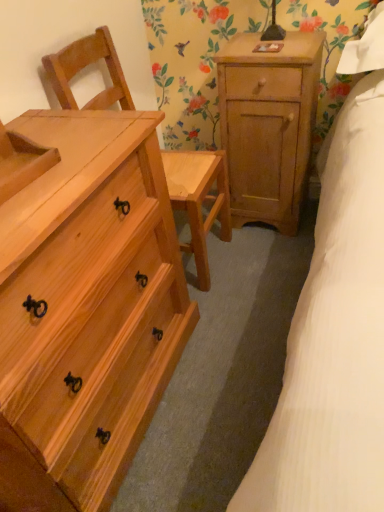
Question: Does point (62, 399) appear closer or farther from the camera than point (228, 87)?

Choices:
 (A) farther
 (B) closer

Answer: (B)

Question: Is natural wood chest of drawers at left inside or outside of natural wood nightstand at upper right?

Choices:
 (A) outside
 (B) inside

Answer: (A)

Question: Which object is the farthest from the natural wood chest of drawers at left?

Choices:
 (A) natural wood chair at left
 (B) natural wood nightstand at upper right

Answer: (B)

Question: Estimate the real-world distances between objects in this image. Which object is closer to the natural wood chair at left?

Choices:
 (A) natural wood chest of drawers at left
 (B) natural wood nightstand at upper right

Answer: (B)